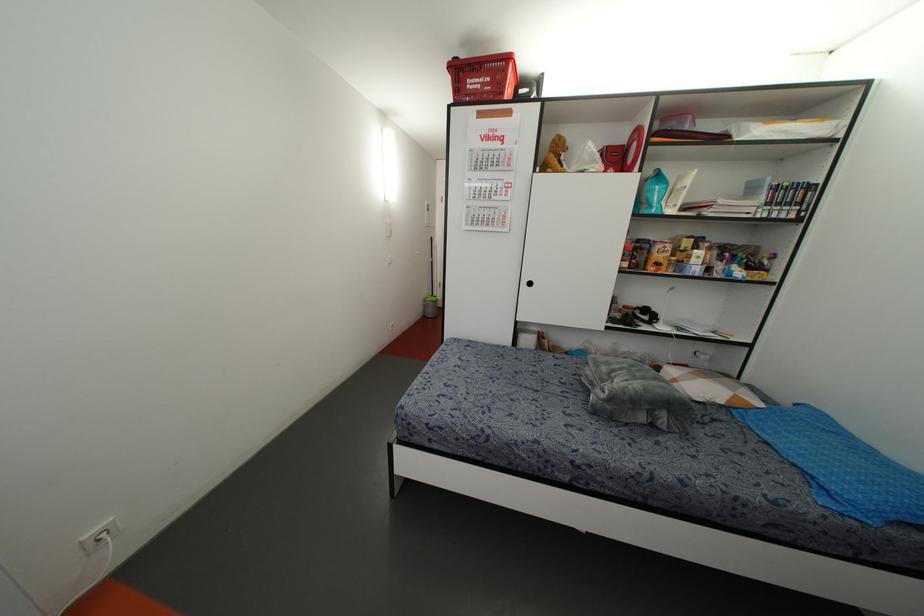
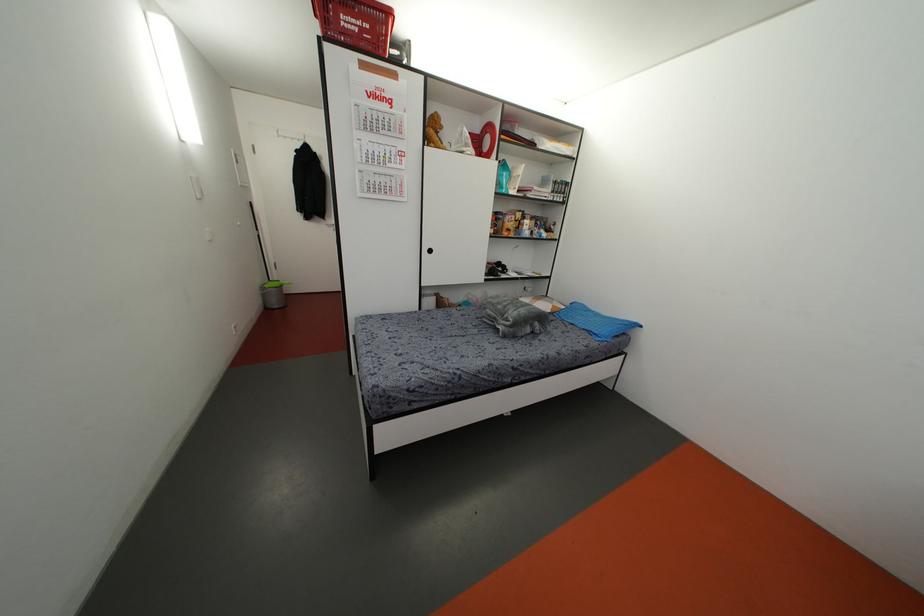
In the second image, find the point that corresponds to pixel 657 264 in the first image.

(507, 229)